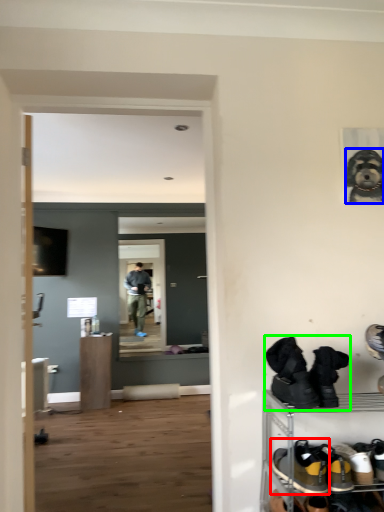
Question: Which object is positioned closest to footwear (highlighted by a red box)? Select from dog (highlighted by a blue box) and footwear (highlighted by a green box).

Choices:
 (A) dog
 (B) footwear

Answer: (B)